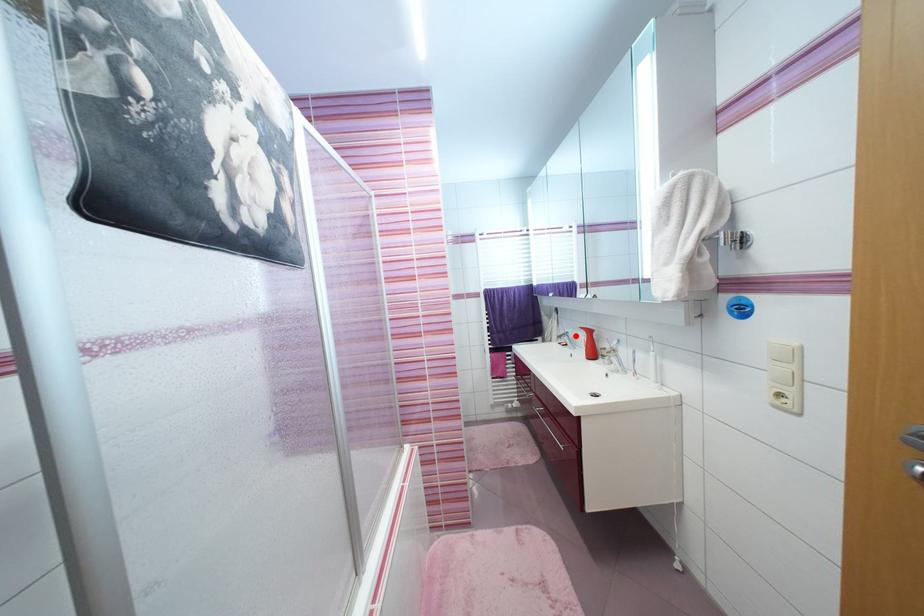
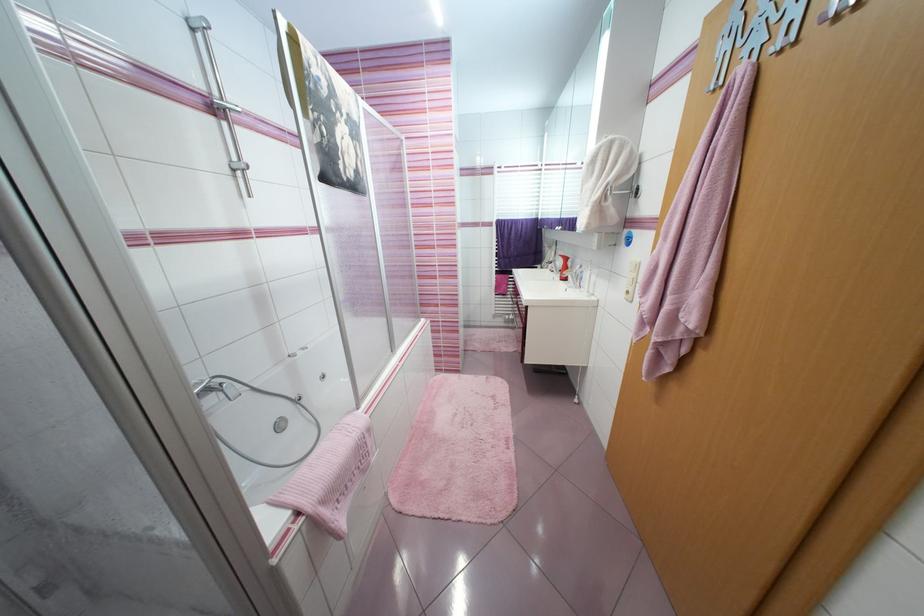
Locate, in the second image, the point that corresponds to the highlighted location in the first image.

(563, 264)